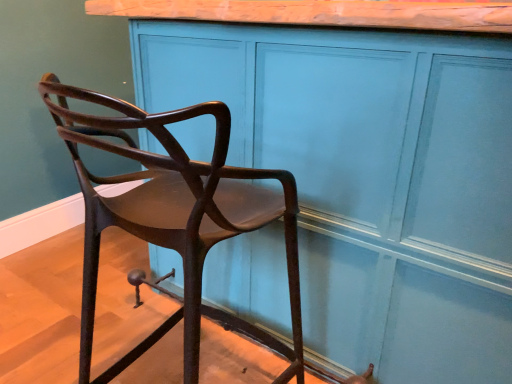
Question: Can you confirm if matte wood cabinet at center is smaller than matte brown chair at left?

Choices:
 (A) no
 (B) yes

Answer: (A)

Question: Does matte wood cabinet at center have a lesser width compared to matte brown chair at left?

Choices:
 (A) yes
 (B) no

Answer: (B)

Question: Could you tell me if matte wood cabinet at center is turned towards matte brown chair at left?

Choices:
 (A) no
 (B) yes

Answer: (B)

Question: Is matte wood cabinet at center oriented away from matte brown chair at left?

Choices:
 (A) yes
 (B) no

Answer: (A)

Question: Is matte wood cabinet at center wider than matte brown chair at left?

Choices:
 (A) yes
 (B) no

Answer: (A)

Question: From the image's perspective, is matte wood cabinet at center beneath matte brown chair at left?

Choices:
 (A) yes
 (B) no

Answer: (B)

Question: Considering the relative positions of matte brown chair at left and matte wood cabinet at center in the image provided, is matte brown chair at left behind matte wood cabinet at center?

Choices:
 (A) no
 (B) yes

Answer: (A)

Question: From a real-world perspective, is matte brown chair at left located beneath matte wood cabinet at center?

Choices:
 (A) yes
 (B) no

Answer: (A)

Question: Considering the relative sizes of matte brown chair at left and matte wood cabinet at center in the image provided, is matte brown chair at left taller than matte wood cabinet at center?

Choices:
 (A) no
 (B) yes

Answer: (A)

Question: Does matte brown chair at left have a larger size compared to matte wood cabinet at center?

Choices:
 (A) yes
 (B) no

Answer: (B)

Question: Is matte brown chair at left positioned before matte wood cabinet at center?

Choices:
 (A) no
 (B) yes

Answer: (B)

Question: Is matte brown chair at left touching matte wood cabinet at center?

Choices:
 (A) yes
 (B) no

Answer: (B)

Question: In terms of size, does matte brown chair at left appear bigger or smaller than matte wood cabinet at center?

Choices:
 (A) small
 (B) big

Answer: (A)